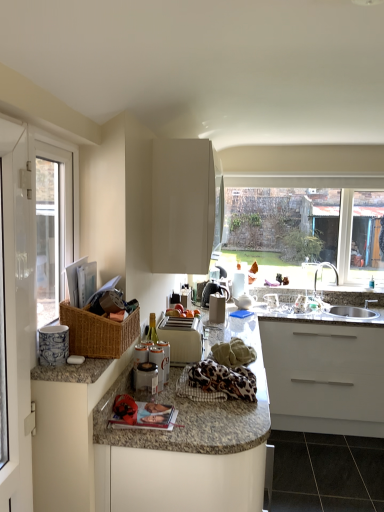
Question: Would you consider satin silver sink at lower right to be distant from leopard print fabric at center?

Choices:
 (A) no
 (B) yes

Answer: (B)

Question: Is satin silver sink at lower right aimed at leopard print fabric at center?

Choices:
 (A) yes
 (B) no

Answer: (A)

Question: From the image's perspective, is satin silver sink at lower right below leopard print fabric at center?

Choices:
 (A) yes
 (B) no

Answer: (B)

Question: From a real-world perspective, is satin silver sink at lower right located beneath leopard print fabric at center?

Choices:
 (A) yes
 (B) no

Answer: (A)

Question: Does satin silver sink at lower right appear on the left side of leopard print fabric at center?

Choices:
 (A) yes
 (B) no

Answer: (B)

Question: From a real-world perspective, is granite countertop at center, the 2th cabinetry positioned from the top, above or below white glossy screen door at left?

Choices:
 (A) above
 (B) below

Answer: (B)

Question: Is granite countertop at center, the 2th cabinetry positioned from the top, inside or outside of white glossy screen door at left?

Choices:
 (A) inside
 (B) outside

Answer: (B)

Question: In terms of width, does granite countertop at center, the 2th cabinetry positioned from the top, look wider or thinner when compared to white glossy screen door at left?

Choices:
 (A) wide
 (B) thin

Answer: (A)

Question: Considering the positions of point (258, 372) and point (16, 225), is point (258, 372) closer or farther from the camera than point (16, 225)?

Choices:
 (A) closer
 (B) farther

Answer: (B)

Question: Based on their sizes in the image, would you say blue and white ceramic mug at left, acting as the first appliance starting from the front, is bigger or smaller than white glossy toaster at center, the second appliance when ordered from back to front?

Choices:
 (A) big
 (B) small

Answer: (B)

Question: Considering the relative positions of blue and white ceramic mug at left, which appears as the first appliance when viewed from the left, and white glossy toaster at center, the fourth appliance from the left, in the image provided, is blue and white ceramic mug at left, which appears as the first appliance when viewed from the left, to the left or to the right of white glossy toaster at center, the fourth appliance from the left,?

Choices:
 (A) right
 (B) left

Answer: (B)

Question: Is blue and white ceramic mug at left, acting as the first appliance starting from the front, wider or thinner than white glossy toaster at center, the second appliance when ordered from back to front?

Choices:
 (A) wide
 (B) thin

Answer: (B)

Question: Relative to white glossy toaster at center, the fourth appliance from the left, is blue and white ceramic mug at left, which appears as the first appliance when viewed from the left, in front or behind?

Choices:
 (A) behind
 (B) front

Answer: (B)

Question: Is granite at lower right to the left or to the right of white plastic window frame at left in the image?

Choices:
 (A) right
 (B) left

Answer: (A)

Question: Does point (307, 499) appear closer or farther from the camera than point (39, 162)?

Choices:
 (A) closer
 (B) farther

Answer: (B)